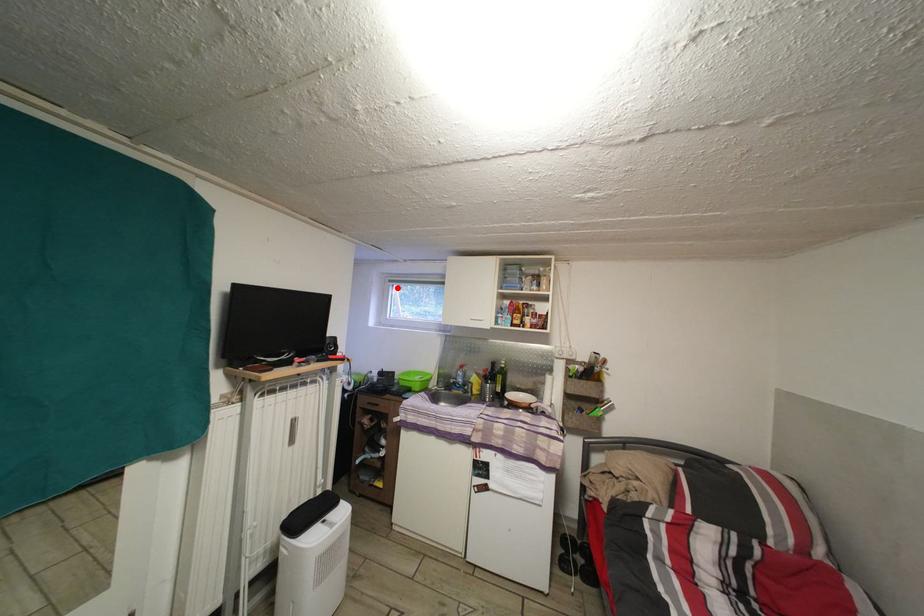
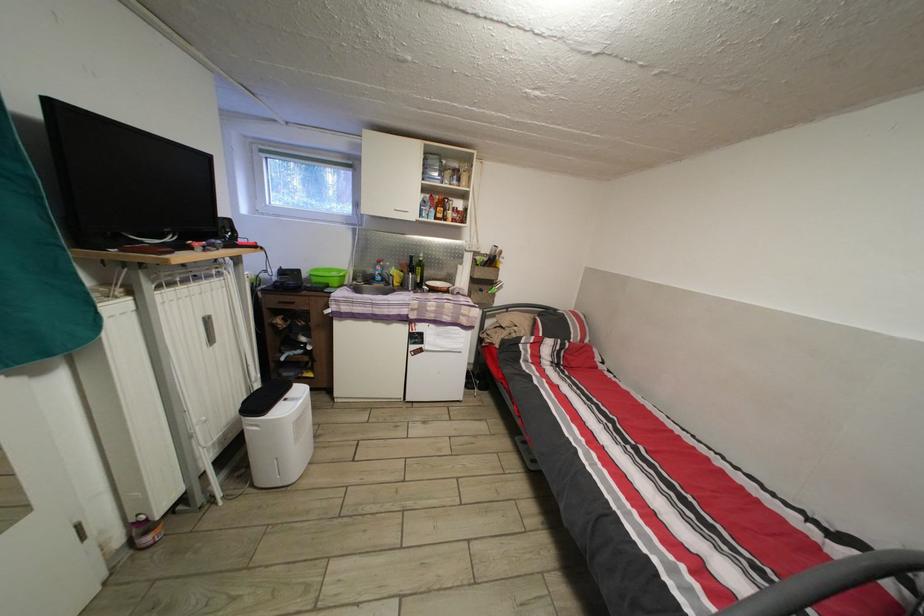
The point at the highlighted location is marked in the first image. Where is the corresponding point in the second image?

(269, 156)